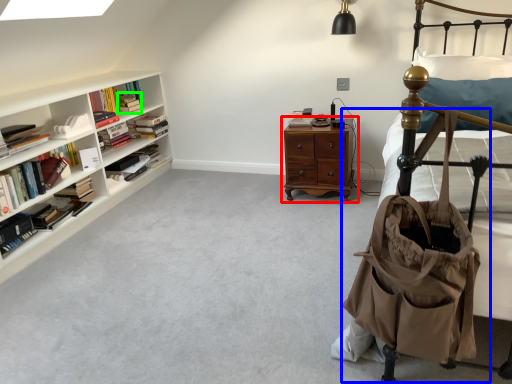
Question: Which object is positioned closest to nightstand (highlighted by a red box)? Select from baby carriage (highlighted by a blue box) and book (highlighted by a green box).

Choices:
 (A) baby carriage
 (B) book

Answer: (B)